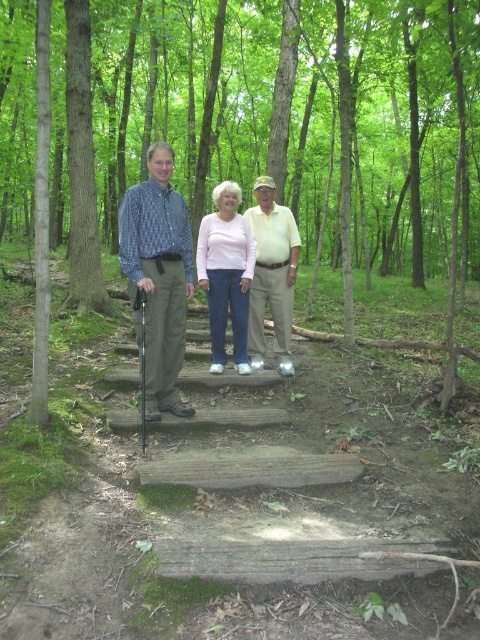
Is green leafy trees at center closer to camera compared to blue plaid shirt at center?

No, green leafy trees at center is further to the viewer.

Where is `green leafy trees at center`? Image resolution: width=480 pixels, height=640 pixels. green leafy trees at center is located at coordinates (301, 120).

The height and width of the screenshot is (640, 480). Identify the location of green leafy trees at center. (301, 120).

Who is taller, pink matte shirt at center or khaki cotton pants at center?

khaki cotton pants at center

Between pink matte shirt at center and khaki cotton pants at center, which one appears on the right side from the viewer's perspective?

From the viewer's perspective, khaki cotton pants at center appears more on the right side.

Does point (232, 296) lie in front of point (259, 369)?

That is True.

At what (x,y) coordinates should I click in order to perform the action: click on pink matte shirt at center. Please return your answer as a coordinate pair (x, y). The image size is (480, 640). Looking at the image, I should click on 226,275.

Between matte blue shirt at center and blue plaid shirt at center, which one has more height?

With more height is blue plaid shirt at center.

Who is positioned more to the left, matte blue shirt at center or blue plaid shirt at center?

matte blue shirt at center

The width and height of the screenshot is (480, 640). I want to click on matte blue shirt at center, so click(x=157, y=280).

In order to click on matte blue shirt at center in this screenshot , I will do `click(157, 280)`.